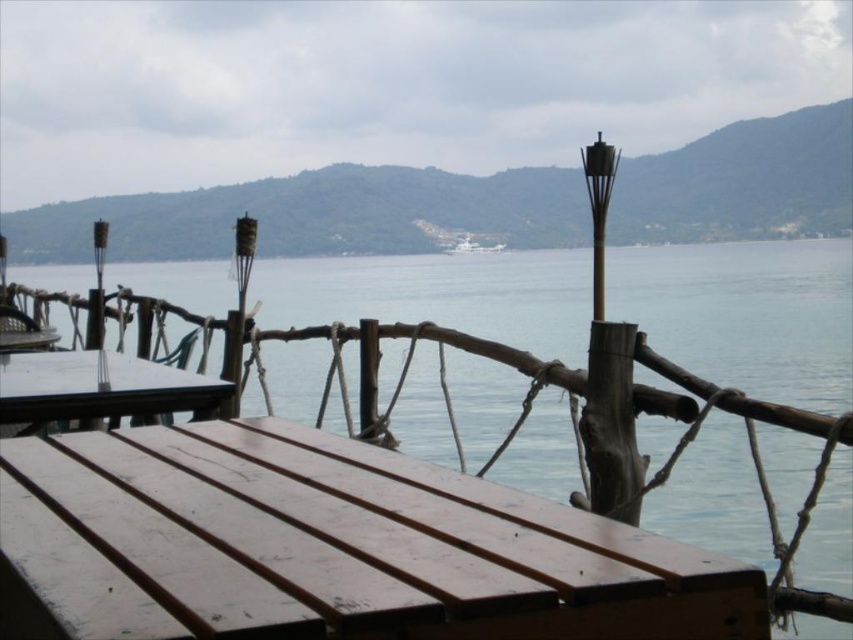
Question: Among these objects, which one is nearest to the camera?

Choices:
 (A) wooden bench at lower left
 (B) wooden picnic table at center

Answer: (A)

Question: Is wooden picnic table at center positioned before white glossy boat at center?

Choices:
 (A) no
 (B) yes

Answer: (B)

Question: From the image, what is the correct spatial relationship of wooden picnic table at center in relation to white glossy boat at center?

Choices:
 (A) right
 (B) left

Answer: (B)

Question: Which point appears farthest from the camera in this image?

Choices:
 (A) (328, 561)
 (B) (461, 252)
 (C) (80, 385)

Answer: (B)

Question: Does wooden bench at lower left appear on the left side of wooden picnic table at center?

Choices:
 (A) yes
 (B) no

Answer: (B)

Question: Which object is positioned closest to the white glossy boat at center?

Choices:
 (A) wooden bench at lower left
 (B) wooden picnic table at center

Answer: (B)